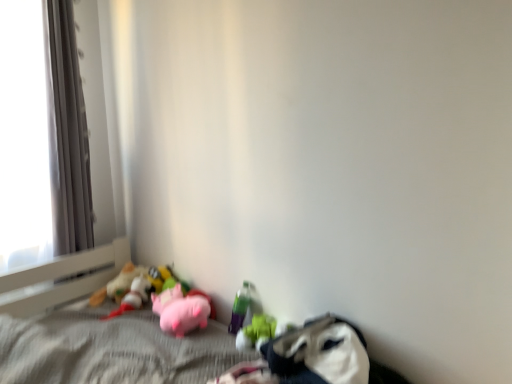
Question: Can you confirm if rubber duck at lower center, which ranks as the first toy in right-to-left order, is smaller than pink plush pig at center?

Choices:
 (A) no
 (B) yes

Answer: (B)

Question: Could you tell me if rubber duck at lower center, arranged as the 4th toy when viewed from the left, is turned towards pink plush pig at center?

Choices:
 (A) yes
 (B) no

Answer: (B)

Question: Considering the relative sizes of rubber duck at lower center, which ranks as the first toy in right-to-left order, and pink plush pig at center in the image provided, is rubber duck at lower center, which ranks as the first toy in right-to-left order, wider than pink plush pig at center?

Choices:
 (A) no
 (B) yes

Answer: (A)

Question: Does rubber duck at lower center, arranged as the 4th toy when viewed from the left, have a lesser height compared to pink plush pig at center?

Choices:
 (A) yes
 (B) no

Answer: (A)

Question: Is rubber duck at lower center, which ranks as the first toy in right-to-left order, completely or partially outside of pink plush pig at center?

Choices:
 (A) no
 (B) yes

Answer: (B)

Question: From the image's perspective, relative to pink plush pig at center, is white plastic window frame at left above or below?

Choices:
 (A) above
 (B) below

Answer: (A)

Question: Is point (13, 1) closer or farther from the camera than point (121, 299)?

Choices:
 (A) farther
 (B) closer

Answer: (B)

Question: Is white plastic window frame at left in front of or behind pink plush pig at center in the image?

Choices:
 (A) behind
 (B) front

Answer: (A)

Question: From a real-world perspective, is white plastic window frame at left positioned above or below pink plush pig at center?

Choices:
 (A) below
 (B) above

Answer: (B)

Question: In terms of width, does white plastic window frame at left look wider or thinner when compared to pink plush pig at lower center, the third toy when ordered from right to left?

Choices:
 (A) wide
 (B) thin

Answer: (A)

Question: From the image's perspective, is white plastic window frame at left above or below pink plush pig at lower center, which is the 2th toy in left-to-right order?

Choices:
 (A) below
 (B) above

Answer: (B)

Question: Is point (48, 49) positioned closer to the camera than point (161, 283)?

Choices:
 (A) farther
 (B) closer

Answer: (B)

Question: Which is correct: white plastic window frame at left is inside pink plush pig at lower center, the third toy when ordered from right to left, or outside of it?

Choices:
 (A) inside
 (B) outside

Answer: (B)

Question: Considering the positions of soft plush toys at lower left, placed as the 1th toy when sorted from left to right, and translucent plastic bottle at lower center, placed as the second toy when sorted from right to left, in the image, is soft plush toys at lower left, placed as the 1th toy when sorted from left to right, taller or shorter than translucent plastic bottle at lower center, placed as the second toy when sorted from right to left,?

Choices:
 (A) short
 (B) tall

Answer: (A)

Question: Is point coord(111,284) positioned closer to the camera than point coord(236,314)?

Choices:
 (A) closer
 (B) farther

Answer: (B)